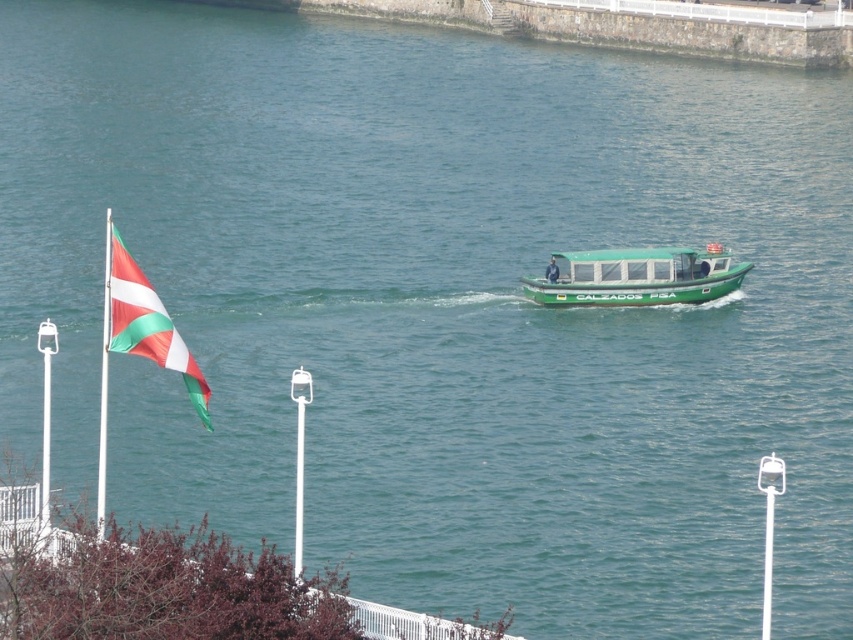
You are standing at the waterfront and want to take a photo that includes both the flagpole and the boat. The flagpole is at point (628,264) and the boat is at point (122,262). Based on their positions, which object should you focus on first to ensure both are in focus?

You should focus on the flagpole at point (628,264) first because it is closer to the camera than the boat at point (122,262). This way, both objects will be in focus as the boat is further away.